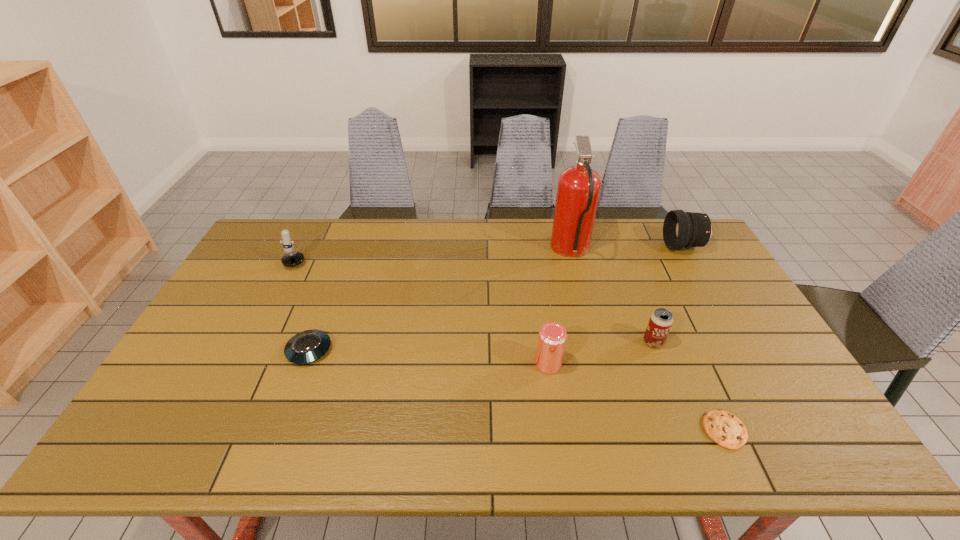
This screenshot has width=960, height=540. I want to click on the fourth object from right to left, so click(578, 191).

This screenshot has height=540, width=960. In order to click on fire extinguisher in this screenshot , I will do `click(578, 191)`.

Identify the location of the rightmost object. This screenshot has width=960, height=540. (681, 229).

The width and height of the screenshot is (960, 540). I want to click on the leftmost object, so click(x=293, y=258).

The image size is (960, 540). Identify the location of the fifth object from right to left. (552, 339).

You are a GUI agent. You are given a task and a screenshot of the screen. Output one action in this format:
    pyautogui.click(x=<x>, y=<y>)
    Task: Click on the nearer beer can
    The width and height of the screenshot is (960, 540).
    Given the screenshot: What is the action you would take?
    pyautogui.click(x=552, y=339)

Identify the location of the third shortest object. Image resolution: width=960 pixels, height=540 pixels. (661, 320).

Locate an element on the screen. This screenshot has width=960, height=540. the right beer can is located at coordinates (661, 320).

Locate an element on the screen. The image size is (960, 540). the second object from left to right is located at coordinates (308, 346).

Identify the location of the sixth tallest object. (308, 346).